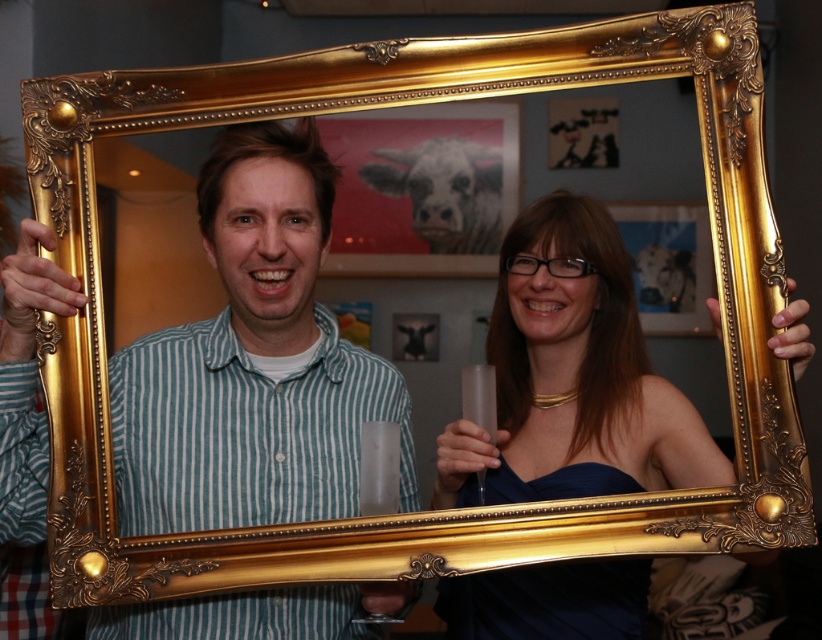
You are standing in the room where the matte gold frame at center is displayed. If you want to take a photo of the frame without anyone blocking it, which direction should you move relative to the frame?

The matte gold frame at center is located at point (x=252, y=362), so you should move to the left or right of the frame to avoid being blocked by the people holding it.